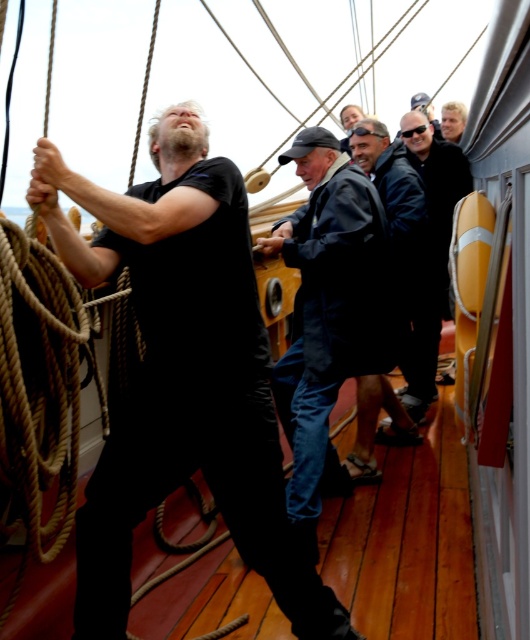
Question: In this image, where is dark blue jacket at center located relative to dark blue denim shorts at center?

Choices:
 (A) above
 (B) below

Answer: (B)

Question: Does dark blue jacket at center come in front of dark blue jacket at right?

Choices:
 (A) no
 (B) yes

Answer: (B)

Question: Which of these objects is positioned closest to the dark blue denim shorts at center?

Choices:
 (A) dark blue jacket at right
 (B) dark blue jacket at center

Answer: (A)

Question: Is dark blue jacket at center bigger than dark blue jacket at right?

Choices:
 (A) no
 (B) yes

Answer: (B)

Question: Which of these objects is positioned closest to the dark blue denim shorts at center?

Choices:
 (A) dark blue jacket at center
 (B) dark blue jacket at right

Answer: (B)

Question: Among these points, which one is farthest from the camera?

Choices:
 (A) (302, 362)
 (B) (417, 362)
 (C) (366, 380)

Answer: (B)